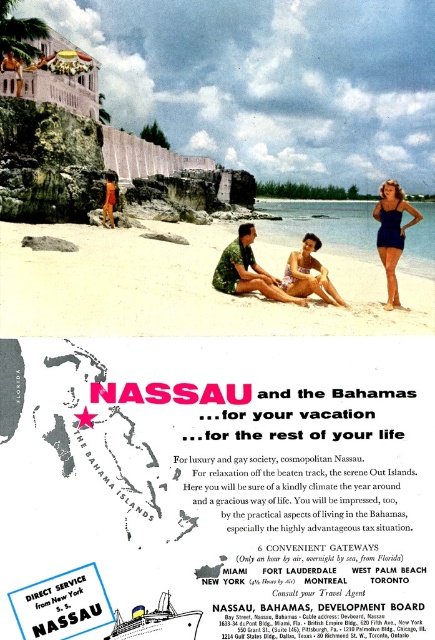
You are a photographer at the beach and want to capture both the matte blue swimsuit at right and the orange swimsuit at center in a single shot. Which swimmer should you position closer to the left side of the frame to include both?

To include both the matte blue swimsuit at right and the orange swimsuit at center in a single shot, position the orange swimsuit at center closer to the left side of the frame since the matte blue swimsuit at right is already to the right of it.

You are a tourist on the beach and you want to take a photo of the white glossy ship at lower center and the beige fabric bikini at center. Which object should you point your camera towards first if you want to capture both in the same frame?

You should point your camera towards the beige fabric bikini at center first because the white glossy ship at lower center is below it, so adjusting the angle to include both would require framing from the top down.

You are a photographer trying to capture a photo of the white sandy beach at center and the orange swimsuit at center. According to the scene, which object is located to the right of the other?

The white sandy beach at center is positioned on the right side of orange swimsuit at center, so the white sandy beach at center is to the right of the orange swimsuit at center.